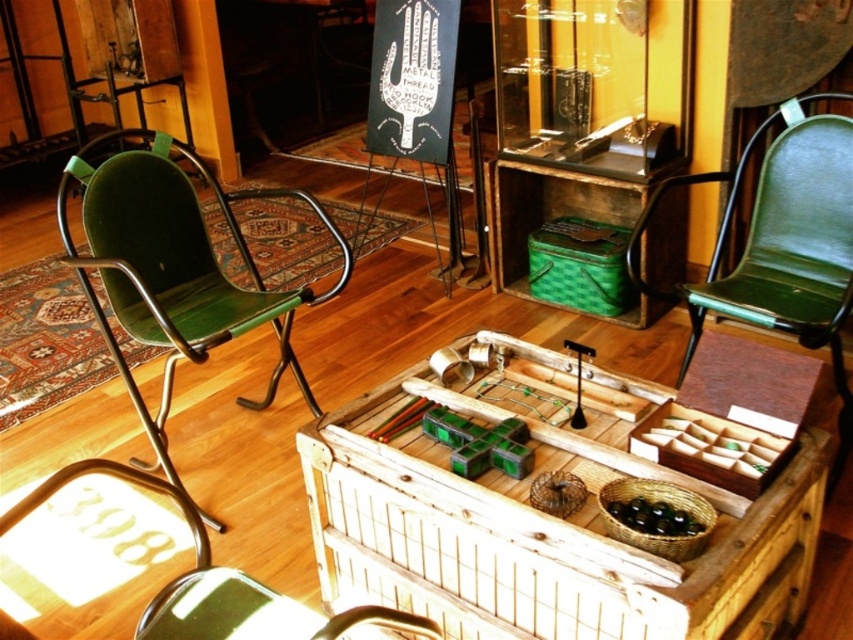
Who is more distant from viewer, (653, 608) or (91, 289)?

The point (91, 289) is behind.

Can you confirm if wooden chest at center is positioned to the right of green leather armchair at left?

Indeed, wooden chest at center is positioned on the right side of green leather armchair at left.

Is point (457, 365) closer to viewer compared to point (108, 234)?

Yes, point (457, 365) is closer to viewer.

I want to click on wooden chest at center, so click(543, 513).

Does green leather armchair at left have a lesser width compared to green leather armchair at right?

No, green leather armchair at left is not thinner than green leather armchair at right.

Is point (161, 170) more distant than point (780, 138)?

Yes, point (161, 170) is farther from viewer.

This screenshot has height=640, width=853. I want to click on green leather armchair at left, so click(173, 268).

Based on the photo, can you confirm if wooden chest at center is shorter than green leather armchair at right?

Correct, wooden chest at center is not as tall as green leather armchair at right.

Does wooden chest at center appear under green leather armchair at right?

Indeed, wooden chest at center is positioned under green leather armchair at right.

Where is `wooden chest at center`? wooden chest at center is located at coordinates (543, 513).